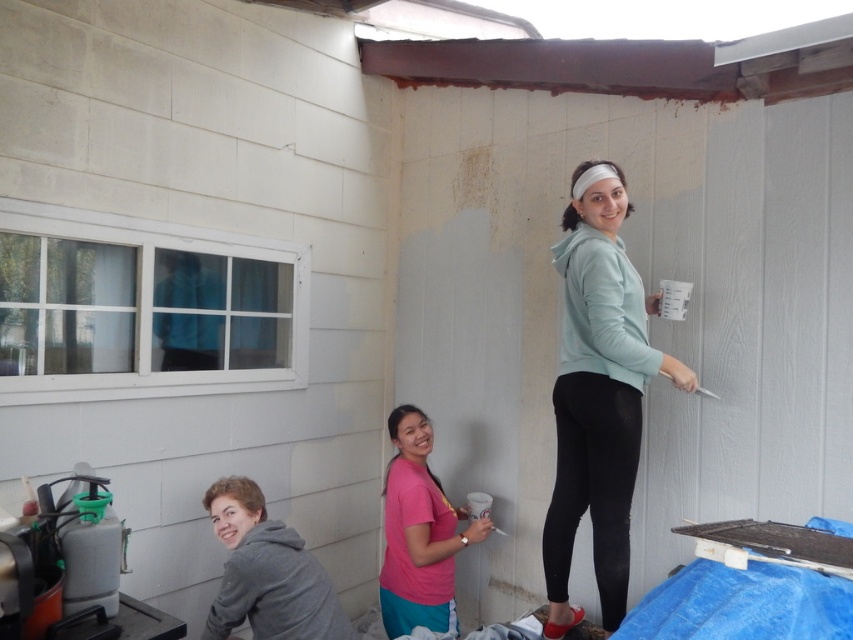
Question: Does matte teal hoodie at center have a larger size compared to pink matte shirt at center?

Choices:
 (A) no
 (B) yes

Answer: (B)

Question: Is matte teal hoodie at center positioned at the back of pink matte shirt at center?

Choices:
 (A) yes
 (B) no

Answer: (B)

Question: Is matte teal hoodie at center bigger than pink matte shirt at center?

Choices:
 (A) yes
 (B) no

Answer: (A)